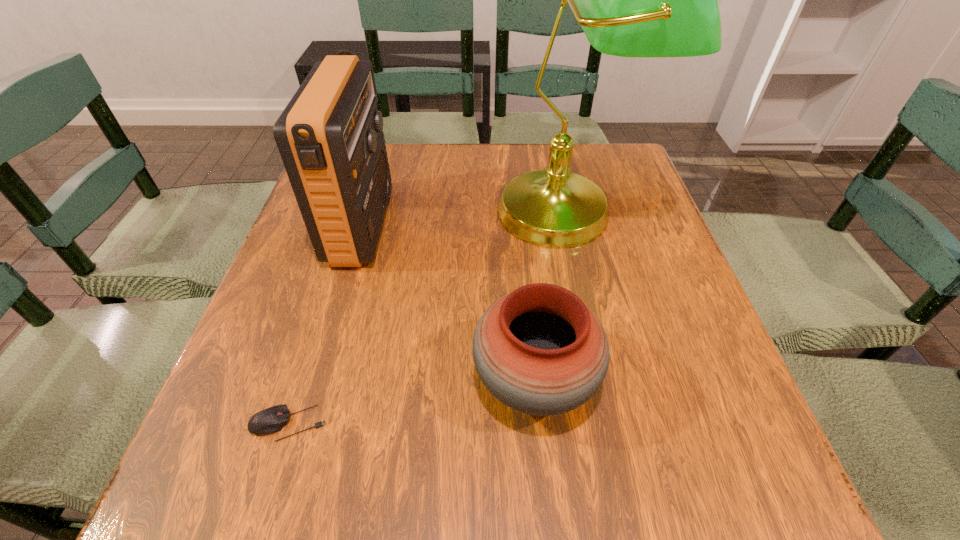
Image resolution: width=960 pixels, height=540 pixels. What are the coordinates of `free space between the tallest object and the radio receiver` in the screenshot? It's located at (464, 219).

Identify the location of empty space between the lamp and the third shortest object. (464, 219).

Where is `free point between the pottery and the mouse`? The image size is (960, 540). free point between the pottery and the mouse is located at coordinates (412, 402).

Identify the location of vacant region between the mouse and the lamp. (427, 318).

I want to click on vacant area that lies between the third tallest object and the shortest object, so click(412, 402).

Image resolution: width=960 pixels, height=540 pixels. In order to click on vacant space that's between the pottery and the radio receiver in this screenshot , I will do `click(448, 303)`.

Locate an element on the screen. Image resolution: width=960 pixels, height=540 pixels. empty space between the tallest object and the second tallest object is located at coordinates 464,219.

Identify the location of free space that is in between the second tallest object and the shortest object. (325, 325).

Where is `free space between the radio receiver and the tallest object`? The width and height of the screenshot is (960, 540). free space between the radio receiver and the tallest object is located at coordinates (464, 219).

In order to click on vacant area that lies between the radio receiver and the third tallest object in this screenshot , I will do `click(448, 303)`.